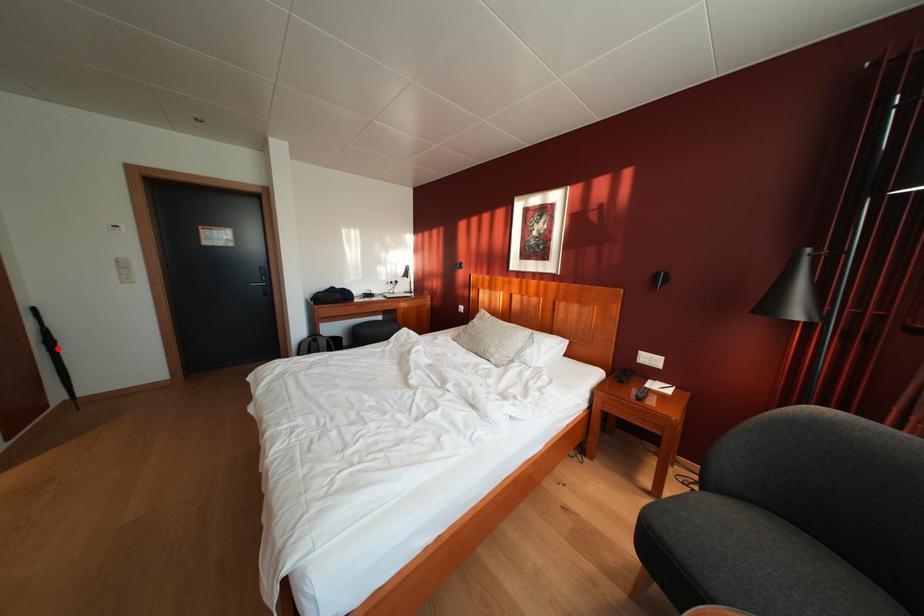
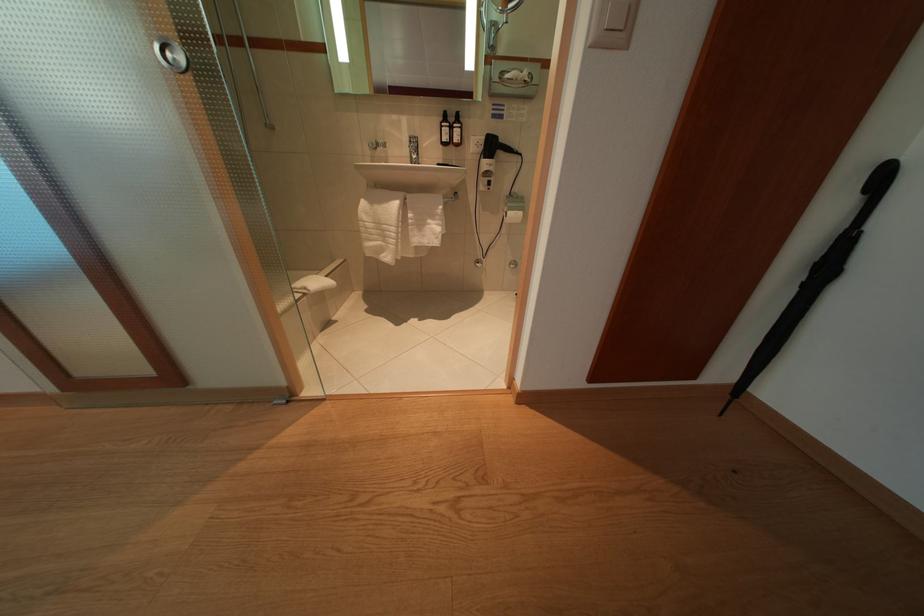
Locate, in the second image, the point that corresponds to the highlighted location in the first image.

(834, 275)